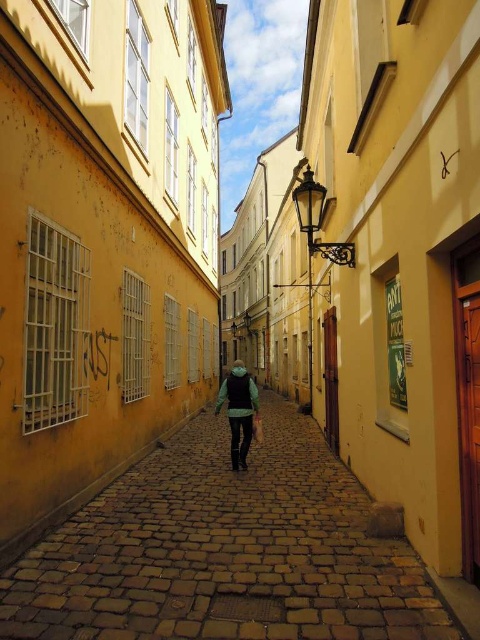
You are standing on the brown cobblestone path at center and want to move to the green fabric jacket at center. Which direction should you face to walk towards it?

You should face to the left because the green fabric jacket at center is to the left of the brown cobblestone path at center.

You are standing on the yellow buildings on the left side of the street and want to walk to the point at coordinates (225, 552). Is this point located on the brown cobblestone path at center?

Yes, the point at coordinates (225, 552) is on the brown cobblestone path at center, so you can walk there directly.

You are standing on the brown cobblestone path at center and want to pick up the green fabric jacket at center. Which direction should you move to reach it?

The green fabric jacket at center is located above the brown cobblestone path at center, so you should move upward to reach it.